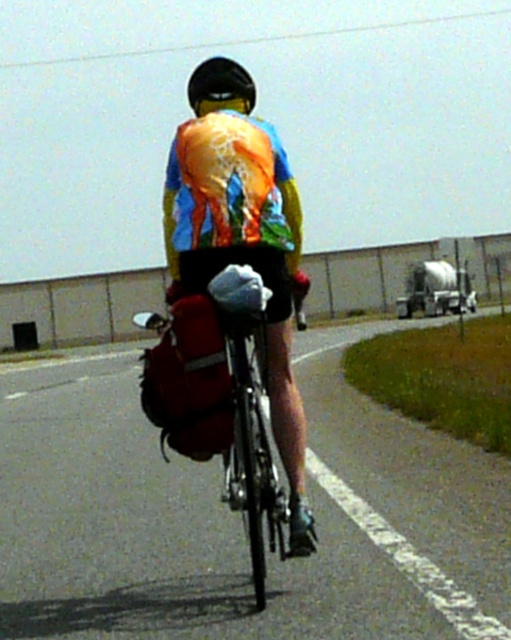
Question: Is the position of shiny reflective safety vest at center more distant than that of black matte helmet at upper center?

Choices:
 (A) yes
 (B) no

Answer: (B)

Question: Considering the relative positions of matte black bicycle at center and shiny reflective safety vest at center in the image provided, where is matte black bicycle at center located with respect to shiny reflective safety vest at center?

Choices:
 (A) below
 (B) above

Answer: (A)

Question: Which object appears farthest from the camera in this image?

Choices:
 (A) shiny reflective safety vest at center
 (B) matte red backpack at center
 (C) black matte helmet at upper center

Answer: (C)

Question: Which object is positioned closest to the black matte helmet at upper center?

Choices:
 (A) matte black bicycle at center
 (B) shiny reflective safety vest at center
 (C) matte red backpack at center

Answer: (C)

Question: Can you confirm if matte red backpack at center is smaller than shiny reflective safety vest at center?

Choices:
 (A) yes
 (B) no

Answer: (B)

Question: Based on their relative distances, which object is nearer to the shiny reflective safety vest at center?

Choices:
 (A) black matte helmet at upper center
 (B) matte red backpack at center
 (C) matte black bicycle at center

Answer: (B)